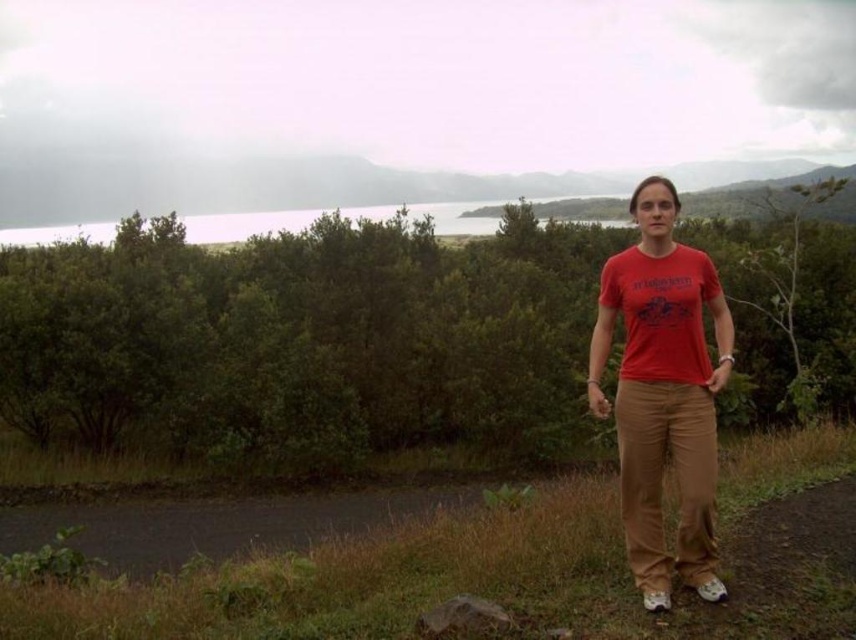
Is red cotton t-shirt at right bigger than matte red t-shirt at center?

Actually, red cotton t-shirt at right might be smaller than matte red t-shirt at center.

Is point (687, 284) farther from camera compared to point (700, 292)?

No, (687, 284) is in front of (700, 292).

What are the coordinates of `red cotton t-shirt at right` in the screenshot? It's located at (663, 392).